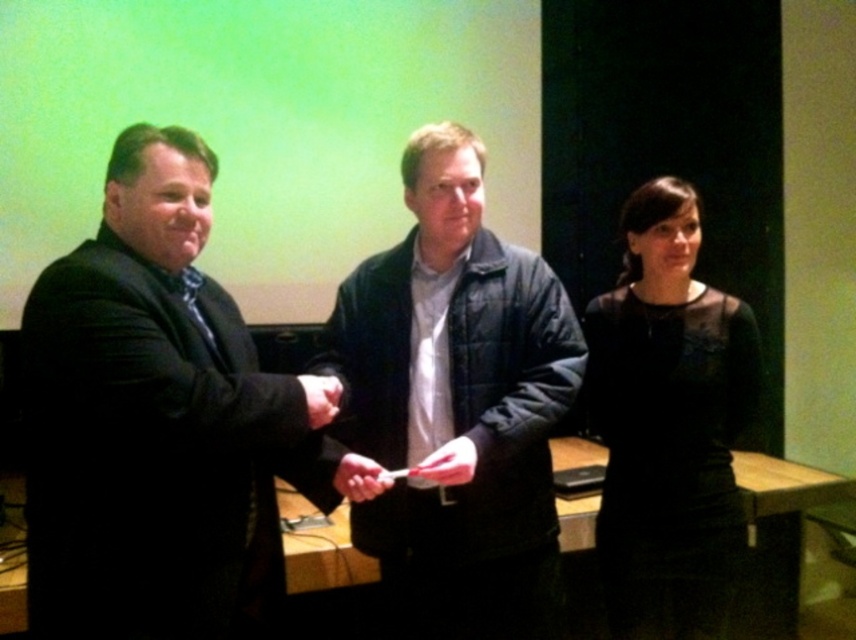
You are standing on the stage and want to move from the point at coordinate point (x=319, y=481) to the point at coordinate point (x=408, y=476). Which direction should you move in to reach the second point?

You should move backward to reach the point at coordinate point (x=408, y=476) because the first point is in front of it.

What is located at the coordinates point [360,477] in the image?

The point [360,477] corresponds to the matte white paper at center.